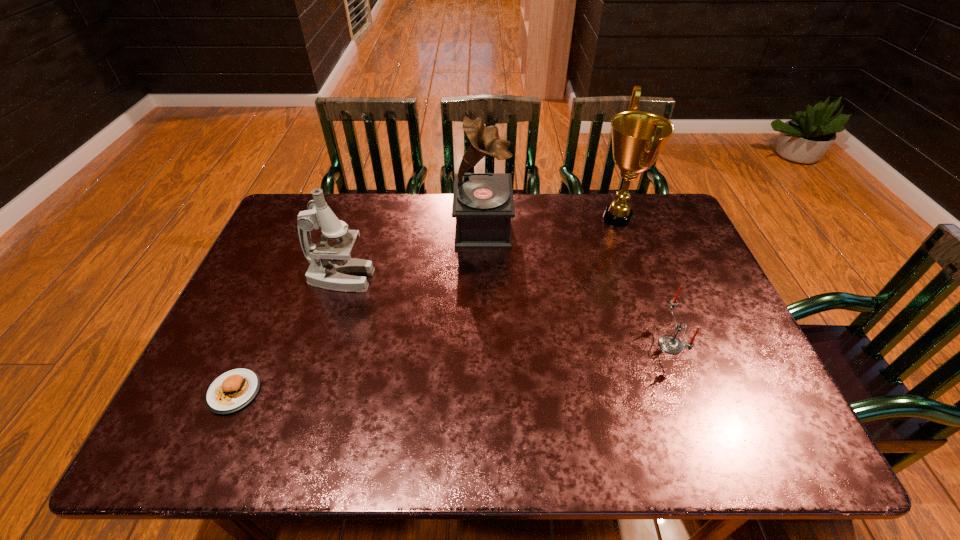
Locate an element on the screen. free area in between the phonograph_record and the candle is located at coordinates (577, 286).

Locate which object is the second closest to the award. Please provide its 2D coordinates. Your answer should be formatted as a tuple, i.e. [(x, y)], where the tuple contains the x and y coordinates of a point satisfying the conditions above.

[(670, 344)]

The image size is (960, 540). I want to click on object that stands as the closest to the food, so click(332, 267).

Where is `free space that satisfies the following two spatial constraints: 1. at the horn opening of the third object from right to left; 2. on the front side of the nearest object`? The image size is (960, 540). free space that satisfies the following two spatial constraints: 1. at the horn opening of the third object from right to left; 2. on the front side of the nearest object is located at coordinates (484, 392).